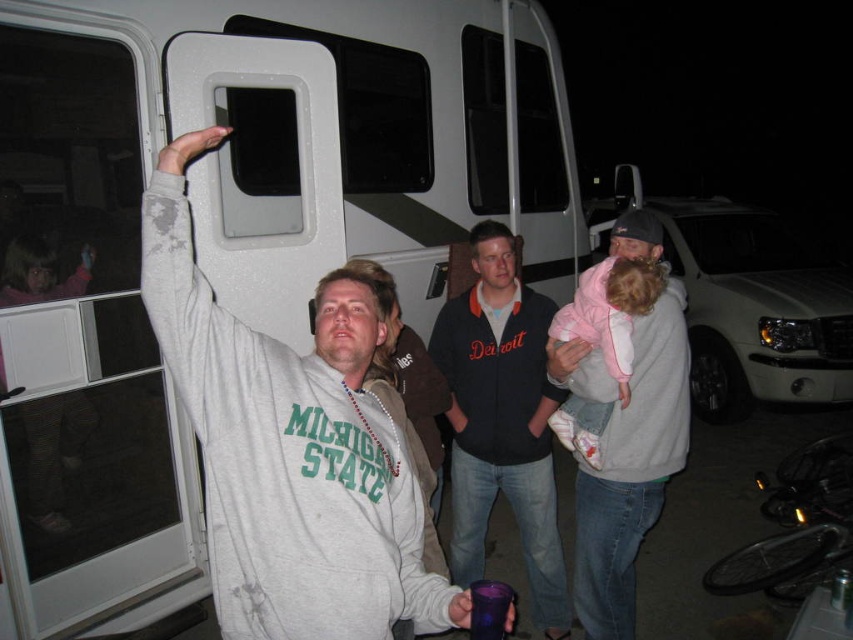
Is white plastic recreational vehicle at center above light pink fleece at upper right?

Yes, white plastic recreational vehicle at center is above light pink fleece at upper right.

Does point (718, 384) come in front of point (599, 301)?

No.

The image size is (853, 640). Find the location of `white plastic recreational vehicle at center`. white plastic recreational vehicle at center is located at coordinates (751, 304).

Does white matte recreational vehicle at upper center appear over light pink fleece at upper right?

Indeed, white matte recreational vehicle at upper center is positioned over light pink fleece at upper right.

Who is lower down, white matte recreational vehicle at upper center or light pink fleece at upper right?

light pink fleece at upper right is below.

Where is `white matte recreational vehicle at upper center`? This screenshot has height=640, width=853. white matte recreational vehicle at upper center is located at coordinates (231, 234).

How distant is white matte recreational vehicle at upper center from dark blue fleece jacket at center?

white matte recreational vehicle at upper center is 3.60 feet away from dark blue fleece jacket at center.

Is white matte recreational vehicle at upper center taller than dark blue fleece jacket at center?

Correct, white matte recreational vehicle at upper center is much taller as dark blue fleece jacket at center.

Is point (120, 625) positioned after point (495, 458)?

No.

Locate an element on the screen. white matte recreational vehicle at upper center is located at coordinates (231, 234).